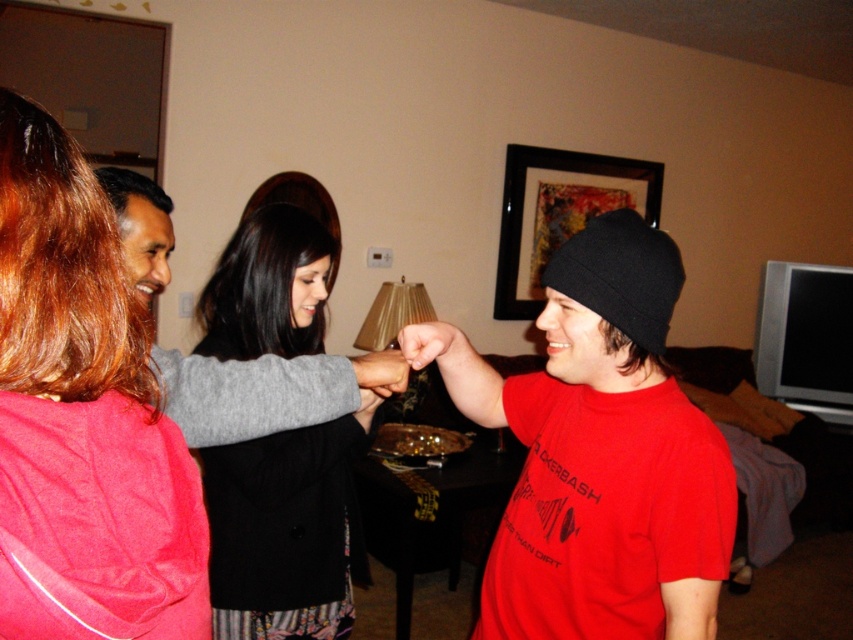
You are a photographer trying to capture a closeup of the red matte beanie at center and the black matte picture frame at upper center. Given that your camera can only focus on objects wider than 10 cm, can both items be captured clearly in the same shot?

The red matte beanie at center is narrower than the black matte picture frame at upper center. Since the camera requires objects to be wider than 10 cm, we need to know the exact width of each. However, the description only states their relative sizes. Without specific measurements, it is impossible to confirm if both meet the 10 cm requirement. Please provide more details about their actual widths.